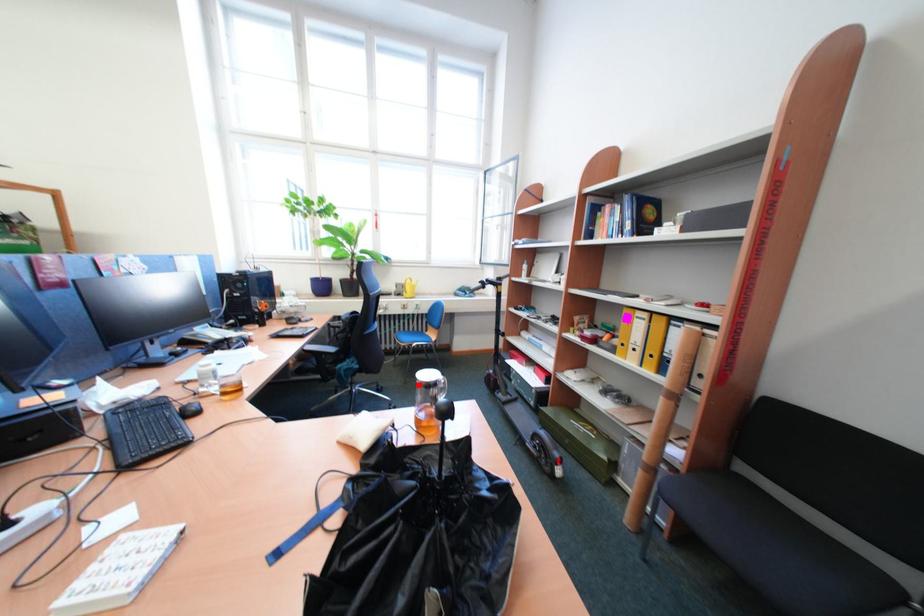
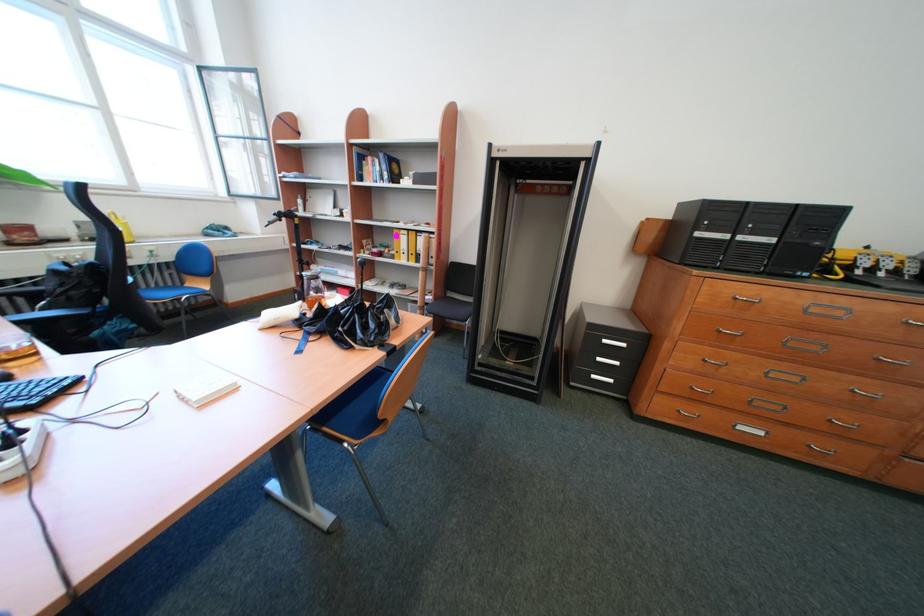
Question: I am providing you with two images of the same scene from different viewpoints. A red point is marked on the first image. At the location where the point appears in image 1, is it still visible in image 2?

Choices:
 (A) Yes
 (B) No

Answer: (B)